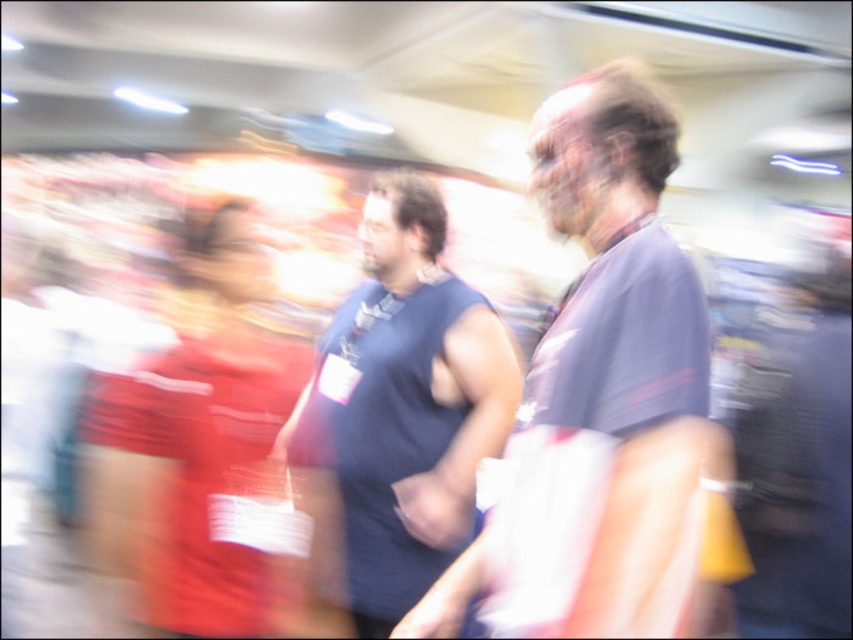
Who is more forward, [699,333] or [190,360]?

Point [699,333]

What do you see at coordinates (619, 340) in the screenshot? The image size is (853, 640). I see `dark blue t-shirt at center` at bounding box center [619, 340].

Does point (659, 195) come in front of point (109, 486)?

That is True.

The height and width of the screenshot is (640, 853). I want to click on dark blue t-shirt at center, so click(619, 340).

What do you see at coordinates (619, 340) in the screenshot?
I see `dark blue t-shirt at center` at bounding box center [619, 340].

Does dark blue t-shirt at center have a lesser height compared to dark blue sleeveless shirt at center?

Yes.

Based on the photo, who is more distant from viewer, (700,467) or (416,292)?

The point (416,292) is behind.

Find the location of a particular element. The image size is (853, 640). dark blue t-shirt at center is located at coordinates (619, 340).

Which is more to the left, dark blue sleeveless shirt at center or matte red dress at left?

Positioned to the left is matte red dress at left.

Is dark blue sleeveless shirt at center wider than matte red dress at left?

No, dark blue sleeveless shirt at center is not wider than matte red dress at left.

Is point (451, 388) positioned before point (199, 292)?

Yes, it is.

Where is `dark blue sleeveless shirt at center`? dark blue sleeveless shirt at center is located at coordinates (399, 412).